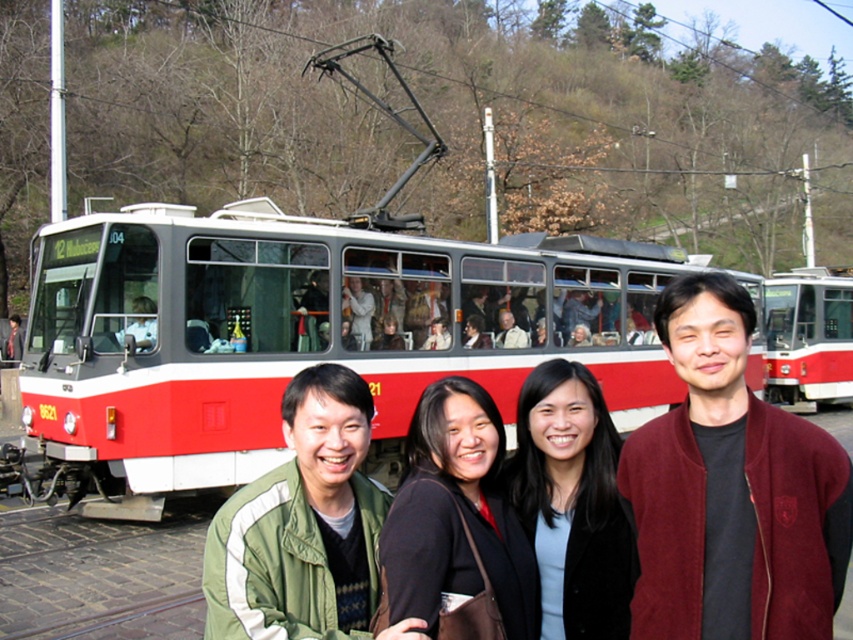
Question: Which point is farther from the camera taking this photo?

Choices:
 (A) (209, 545)
 (B) (769, 420)

Answer: (A)

Question: Where is green fabric jacket at center located in relation to black fabric at center in the image?

Choices:
 (A) right
 (B) left

Answer: (B)

Question: Does red/white metal tram at center appear over matte black jacket at center?

Choices:
 (A) yes
 (B) no

Answer: (A)

Question: Which object is the farthest from the red/white metal tram at center?

Choices:
 (A) green fabric jacket at center
 (B) matte black jacket at center
 (C) black fabric at center

Answer: (A)

Question: Considering the real-world distances, which object is closest to the green fabric jacket at center?

Choices:
 (A) black fabric at center
 (B) matte black jacket at center

Answer: (A)

Question: Is red/white metal tram at center positioned before matte black jacket at center?

Choices:
 (A) no
 (B) yes

Answer: (A)